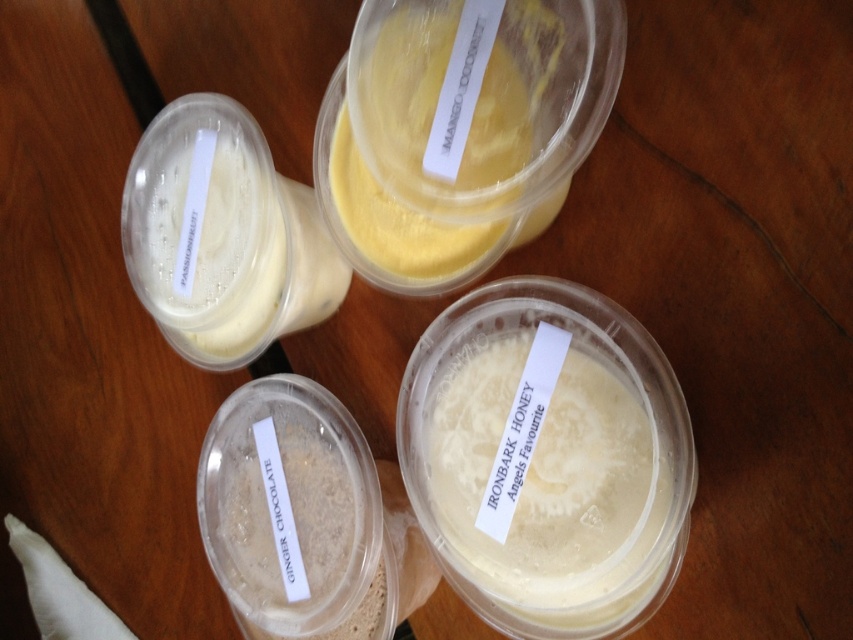
Question: Which object is positioned farthest from the white creamy milkshake at center?

Choices:
 (A) yellow matte jar at upper left
 (B) yellow matte jar at upper center

Answer: (A)

Question: Among these points, which one is farthest from the camera?

Choices:
 (A) (167, 136)
 (B) (410, 164)

Answer: (A)

Question: Does white creamy milkshake at center have a smaller size compared to yellow matte jar at upper center?

Choices:
 (A) no
 (B) yes

Answer: (B)

Question: Does white creamy milkshake at center lie behind yellow matte jar at upper center?

Choices:
 (A) yes
 (B) no

Answer: (B)

Question: Is white creamy milkshake at center thinner than yellow matte jar at upper left?

Choices:
 (A) yes
 (B) no

Answer: (A)

Question: Which of the following is the closest to the observer?

Choices:
 (A) yellow matte jar at upper center
 (B) white creamy milkshake at center

Answer: (B)